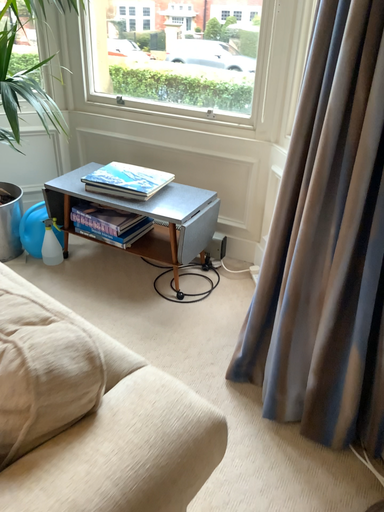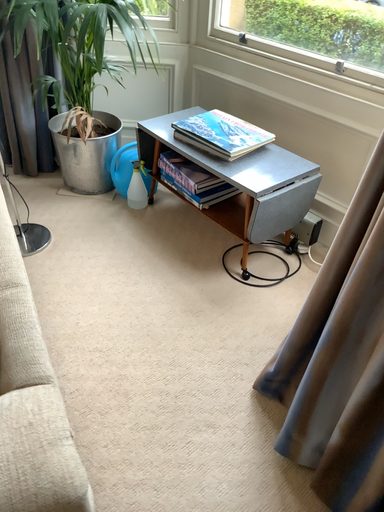
Question: Which way did the camera rotate in the video?

Choices:
 (A) rotated left
 (B) rotated right

Answer: (A)